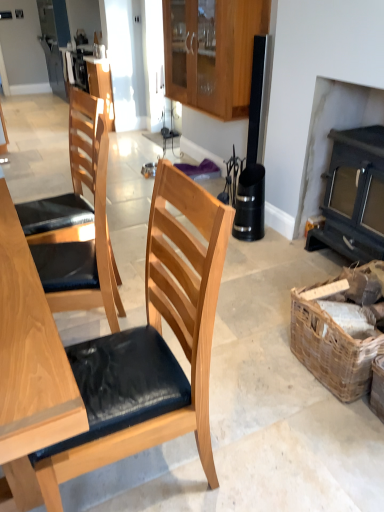
Find the location of a particular element. free space between wooden chair with cushion at center, which is the 1th chair from bottom to top, and woven brown picnic basket at lower right is located at coordinates (263, 406).